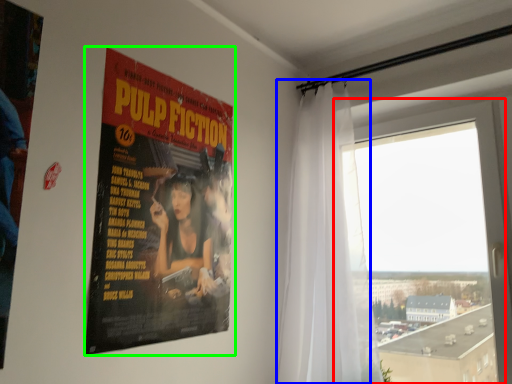
Question: Considering the real-world distances, which object is closest to window (highlighted by a red box)? curtain (highlighted by a blue box) or poster (highlighted by a green box).

Choices:
 (A) curtain
 (B) poster

Answer: (A)